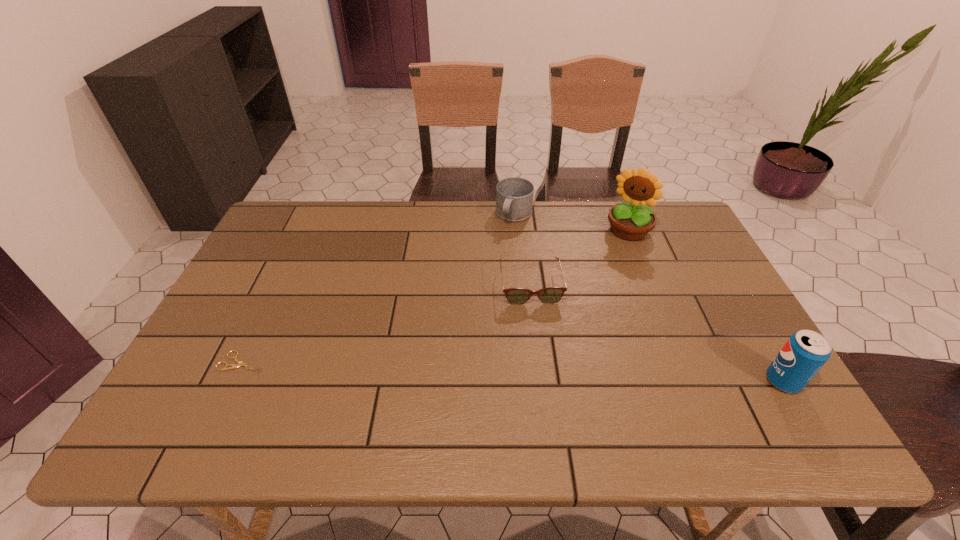
Identify the location of vacant region that satisfies the following two spatial constraints: 1. on the back side of the third shortest object; 2. on the left side of the shears. click(x=313, y=215).

Locate an element on the screen. This screenshot has height=540, width=960. free region that satisfies the following two spatial constraints: 1. on the back side of the second object from right to left; 2. on the right side of the shortest object is located at coordinates (305, 231).

Find the location of a particular element. Image resolution: width=960 pixels, height=540 pixels. free region that satisfies the following two spatial constraints: 1. on the back side of the spectacles; 2. on the left side of the shears is located at coordinates (279, 285).

You are a GUI agent. You are given a task and a screenshot of the screen. Output one action in this format:
    pyautogui.click(x=<x>, y=<y>)
    Task: Click on the free point that satisfies the following two spatial constraints: 1. on the back side of the shortest object; 2. on the left side of the third tallest object
    
    Given the screenshot: What is the action you would take?
    pyautogui.click(x=313, y=215)

Identify the location of free point that satisfies the following two spatial constraints: 1. on the back side of the third shortest object; 2. on the left side of the shortest object. (313, 215).